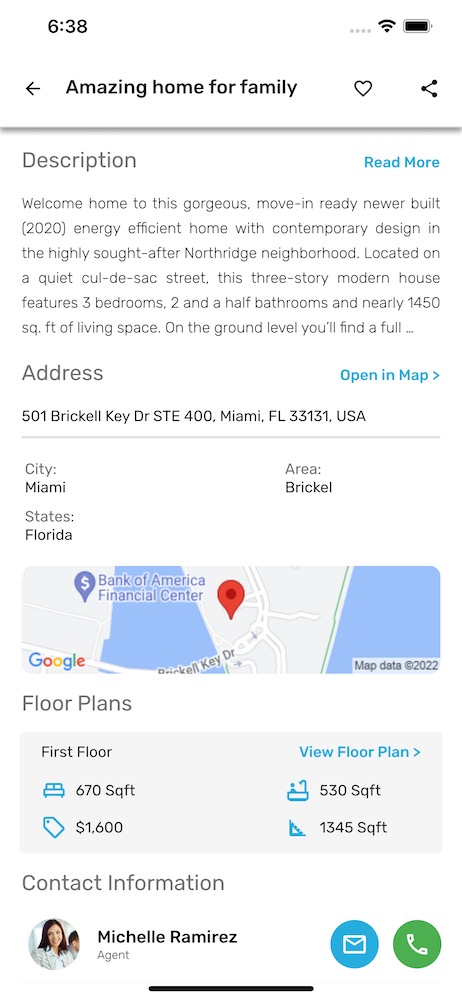
Locate an element on the screen. bathroom square footage is located at coordinates (352, 790).